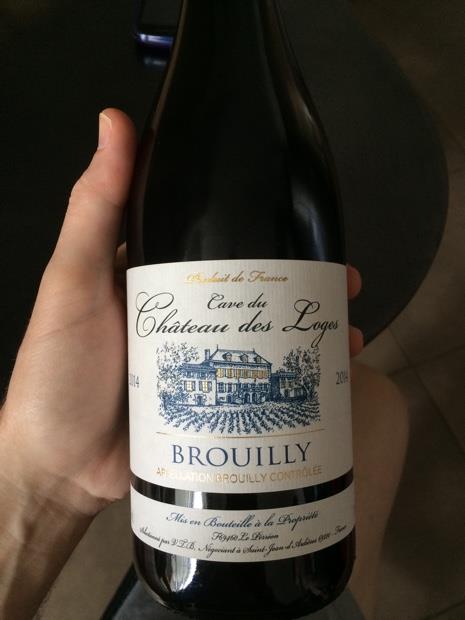
At what (x,y) coordinates should I click in order to perform the action: click on tile flooring. Please return your answer as a coordinate pair (x, y). The height and width of the screenshot is (620, 465). Looking at the image, I should click on (432, 312), (443, 387).